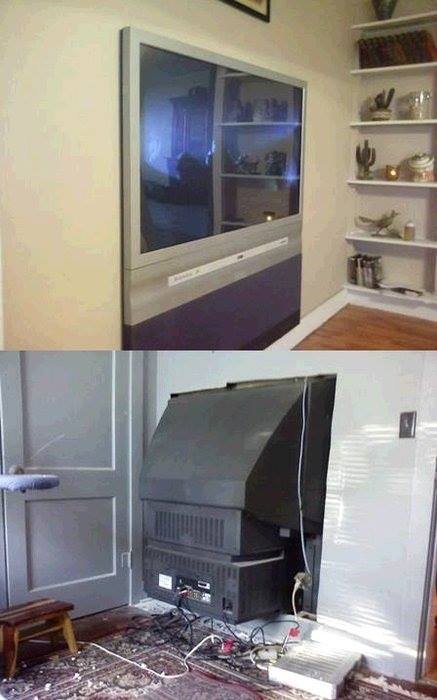
Locate an element on the screen. beige colored wall is located at coordinates (36, 129), (335, 203).